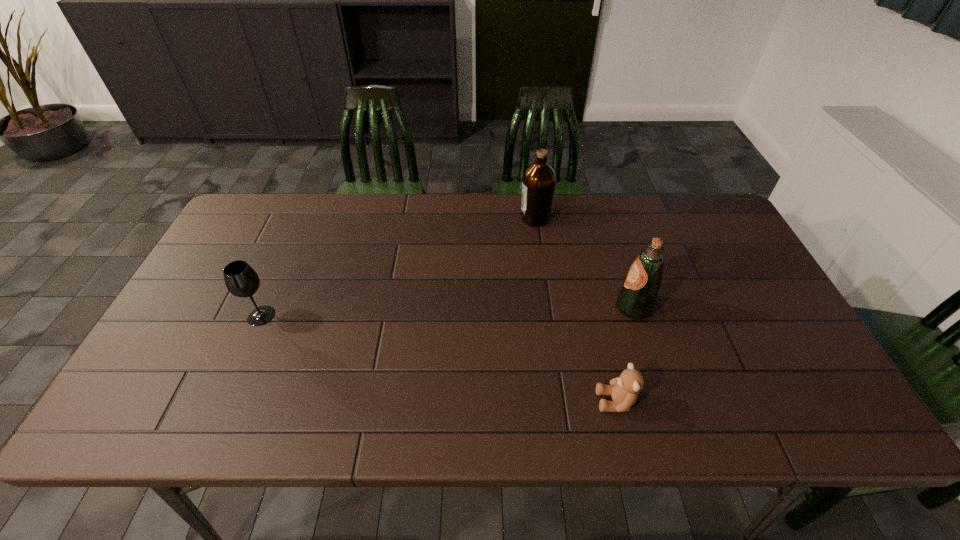
Identify the location of empty space between the right olive oil and the farthest object. The height and width of the screenshot is (540, 960). (584, 263).

Find the location of a particular element. The height and width of the screenshot is (540, 960). empty space between the farther olive oil and the teddy bear is located at coordinates pos(575,310).

Image resolution: width=960 pixels, height=540 pixels. Find the location of `empty space between the farther olive oil and the second shortest object`. empty space between the farther olive oil and the second shortest object is located at coordinates (398, 267).

I want to click on free spot between the third object from right to left and the right olive oil, so click(x=584, y=263).

At what (x,y) coordinates should I click in order to perform the action: click on vacant space that's between the teddy bear and the third tallest object. Please return your answer as a coordinate pair (x, y). Looking at the image, I should click on (439, 359).

Find the location of a particular element. This screenshot has width=960, height=540. empty space that is in between the nearer olive oil and the farthest object is located at coordinates (584, 263).

Identify the location of free area in between the left olive oil and the wineglass. (398, 267).

The width and height of the screenshot is (960, 540). I want to click on object that ranks as the second closest to the shortest object, so click(x=539, y=179).

This screenshot has height=540, width=960. I want to click on the third closest object to the second shortest object, so click(x=636, y=299).

Locate an element on the screen. free space that satisfies the following two spatial constraints: 1. on the front-facing side of the rightmost object; 2. on the front side of the wineglass is located at coordinates (636, 316).